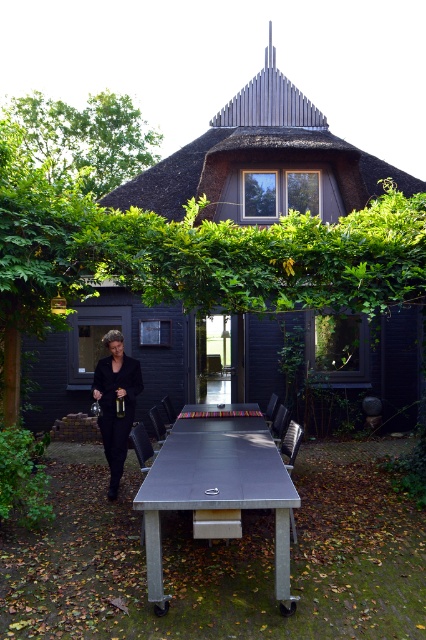
Is dark gray wooden hut at center smaller than metallic silver picnic table at center?

Actually, dark gray wooden hut at center might be larger than metallic silver picnic table at center.

What do you see at coordinates (262, 161) in the screenshot? The height and width of the screenshot is (640, 426). I see `dark gray wooden hut at center` at bounding box center [262, 161].

Measure the distance between dark gray wooden hut at center and camera.

They are 8.77 meters apart.

Identify the location of dark gray wooden hut at center. (262, 161).

From the picture: Measure the distance between point (74, 362) and camera.

Point (74, 362) is 10.38 meters from camera.

Does dark gray wooden hut at center have a greater height compared to black fabric coat at left?

Correct, dark gray wooden hut at center is much taller as black fabric coat at left.

Where is `dark gray wooden hut at center`? This screenshot has height=640, width=426. dark gray wooden hut at center is located at coordinates pos(262,161).

Can you confirm if metallic silver picnic table at center is bigger than black fabric coat at left?

Yes.

Does metallic silver picnic table at center have a lesser width compared to black fabric coat at left?

In fact, metallic silver picnic table at center might be wider than black fabric coat at left.

Where is `metallic silver picnic table at center`? This screenshot has height=640, width=426. metallic silver picnic table at center is located at coordinates (218, 486).

Where is `metallic silver picnic table at center`? metallic silver picnic table at center is located at coordinates (218, 486).